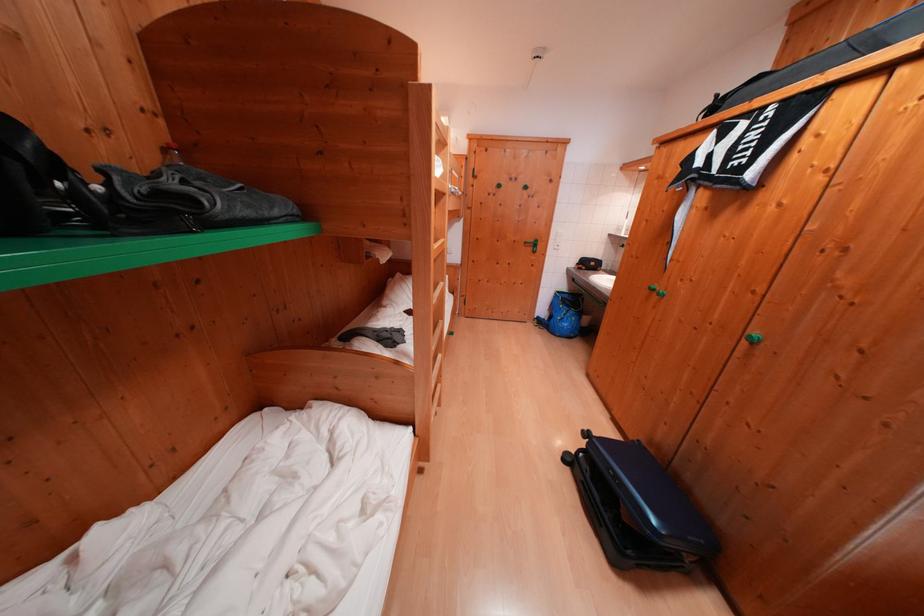
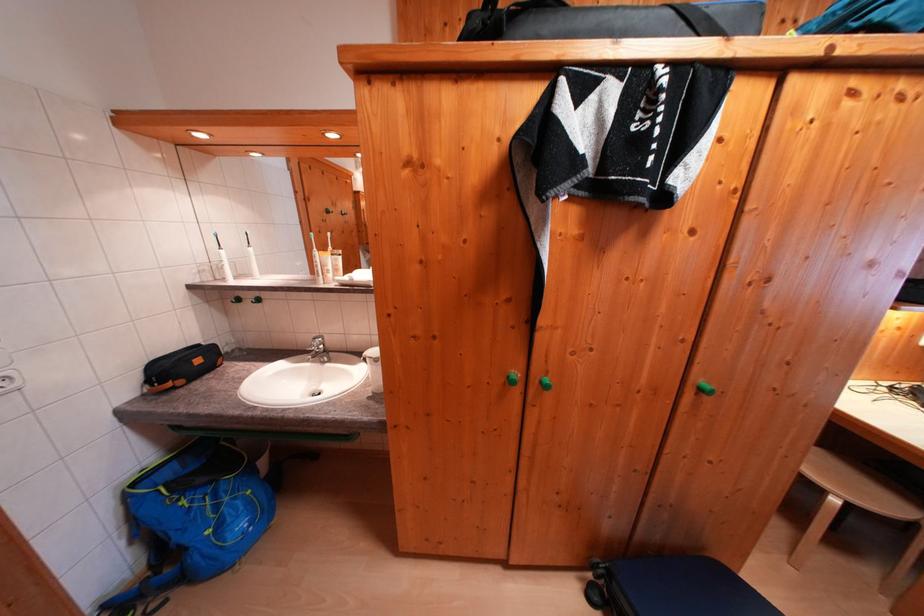
In the second image, find the point that corresponds to the point at 565,296 in the first image.

(142, 488)